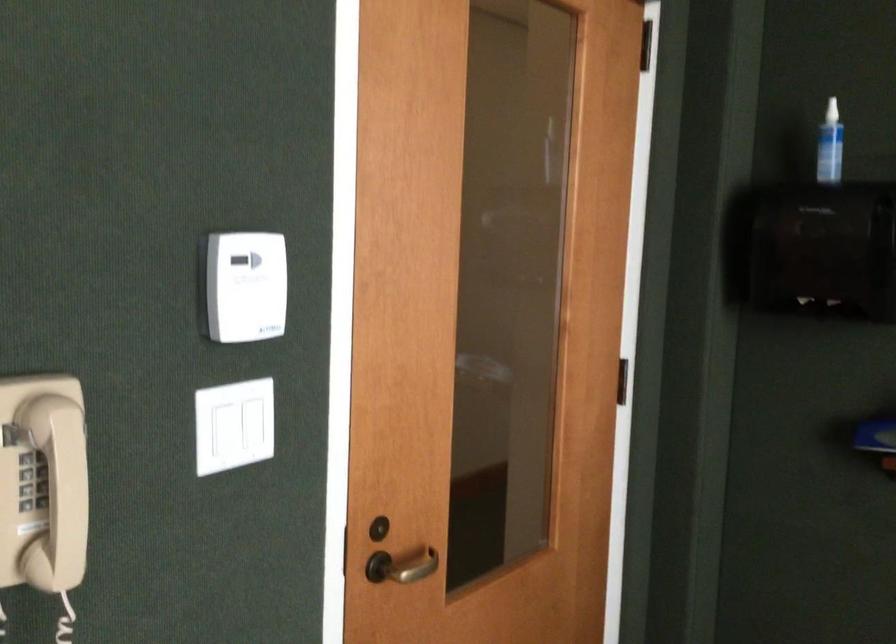
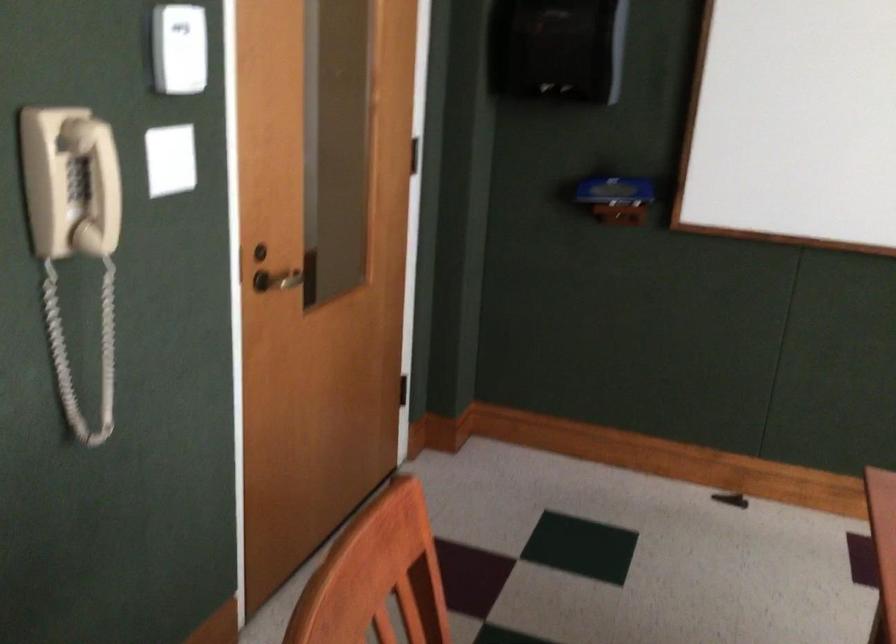
In a continuous first-person perspective shot, in which direction is the camera moving?

The movement direction of the cameraman is left, backward.